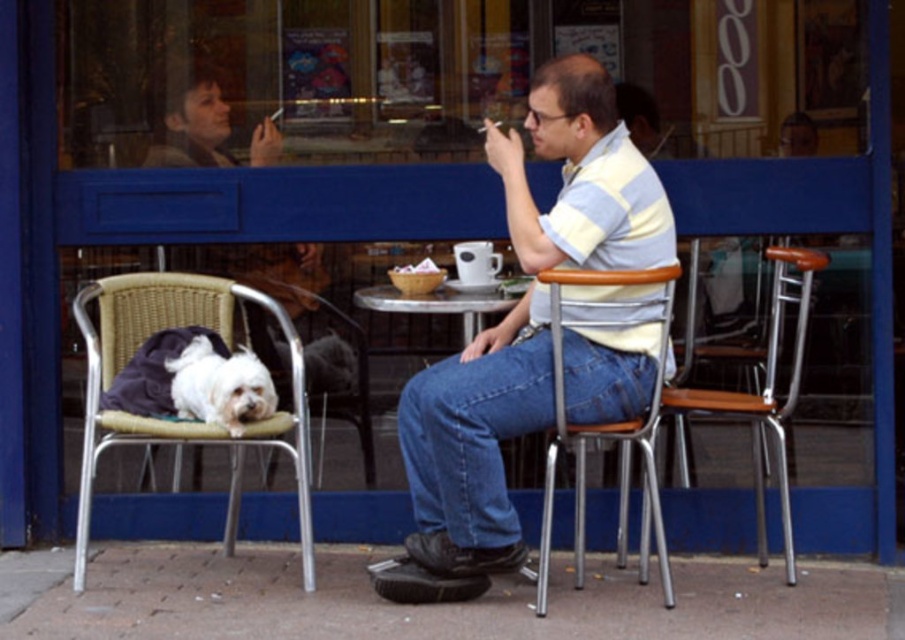
Question: Considering the real-world distances, which object is closest to the striped cotton shirt at center?

Choices:
 (A) white fur dog at left
 (B) matte black jacket at upper left
 (C) metal/wooden chair at center

Answer: (C)

Question: Is white fur dog at left bigger than wooden seat at right?

Choices:
 (A) no
 (B) yes

Answer: (A)

Question: Among these objects, which one is nearest to the camera?

Choices:
 (A) white fur dog at left
 (B) metallic silver table at center

Answer: (B)

Question: Observing the image, what is the correct spatial positioning of white fluffy dog at lower left in reference to metallic silver table at center?

Choices:
 (A) left
 (B) right

Answer: (A)

Question: Among these points, which one is nearest to the camera?

Choices:
 (A) (117, 282)
 (B) (624, 326)

Answer: (B)

Question: Does woven wicker chair at left have a lesser width compared to metallic silver table at center?

Choices:
 (A) yes
 (B) no

Answer: (B)